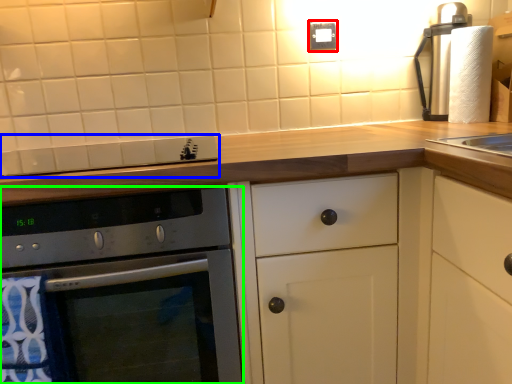
Question: Which is farther away from electric outlet (highlighted by a red box)? gas stove (highlighted by a blue box) or oven (highlighted by a green box)?

Choices:
 (A) gas stove
 (B) oven

Answer: (B)